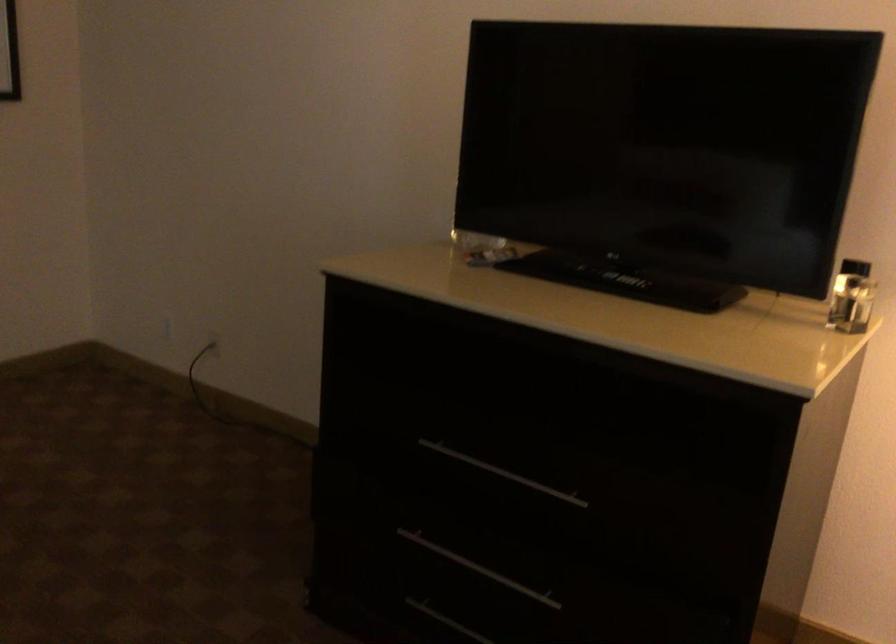
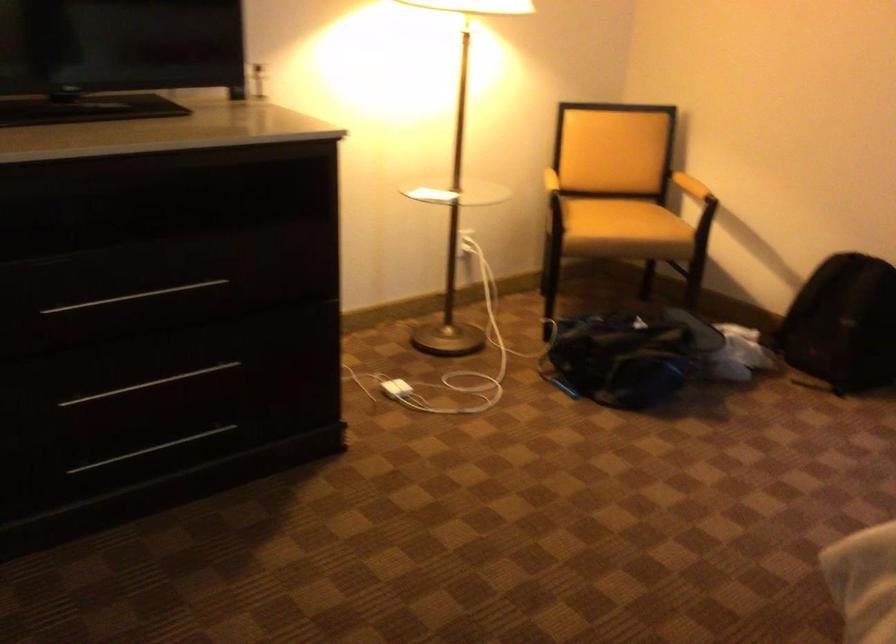
In the second image, find the point that corresponds to [520,480] in the first image.

(134, 297)